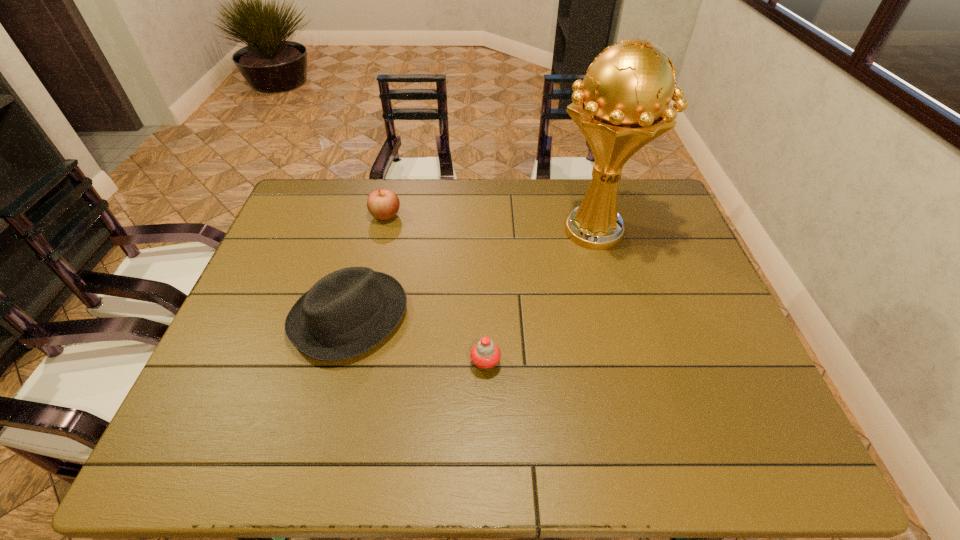
Locate an element on the screen. The height and width of the screenshot is (540, 960). free spot that satisfies the following two spatial constraints: 1. on the back side of the fedora; 2. on the left side of the apple is located at coordinates (375, 216).